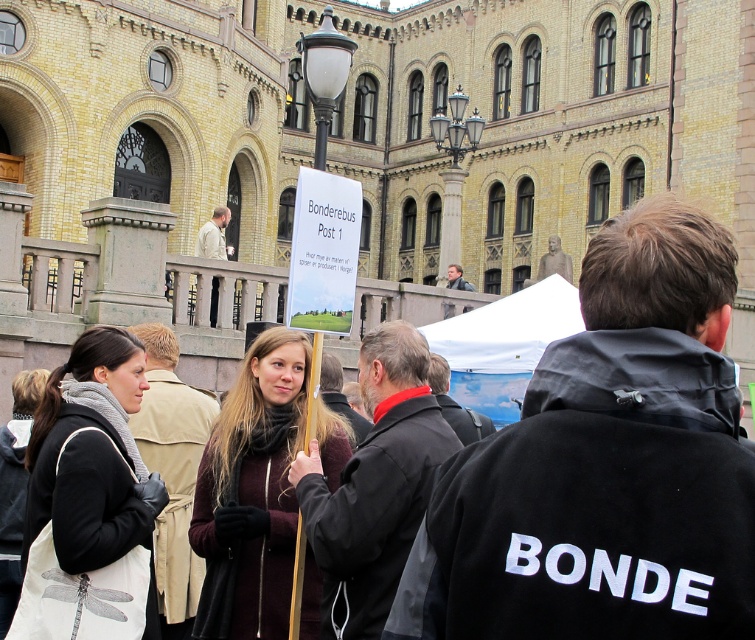
You are organizing a small outdoor event and need to place two items in the foreground of the scene. You have a black fabric bag at lower left and a maroon woolen sweater at center. Which item takes up more space in the foreground?

The maroon woolen sweater at center occupies more space than the black fabric bag at lower left in the foreground.

You are a photographer trying to capture a closeup of the maroon woolen sweater at center without including the black fabric bag at lower left in the frame. Based on their positions, is this possible?

The black fabric bag at lower left is above the maroon woolen sweater at center, so the bag is positioned higher up. This means the sweater is lower, so if you angle the camera downward slightly, you can capture the sweater without the bag appearing in the frame.

You are a photographer standing in front of the historic building and want to take a photo that includes both the black fabric bag at lower left and the maroon woolen sweater at center. Which object should you focus on first to ensure both are in the frame?

You should focus on the black fabric bag at lower left first because it is closer to you than the maroon woolen sweater at center, ensuring both are in the frame.